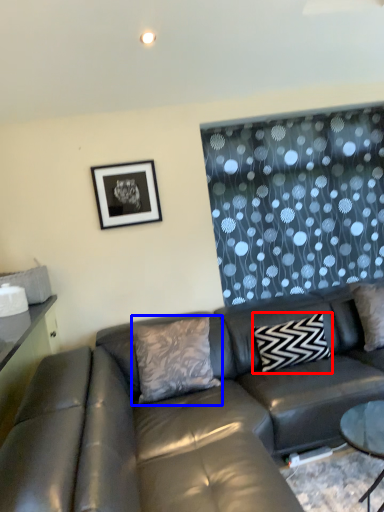
Question: Which object appears farthest to the camera in this image, pillow (highlighted by a red box) or pillow (highlighted by a blue box)?

Choices:
 (A) pillow
 (B) pillow

Answer: (A)